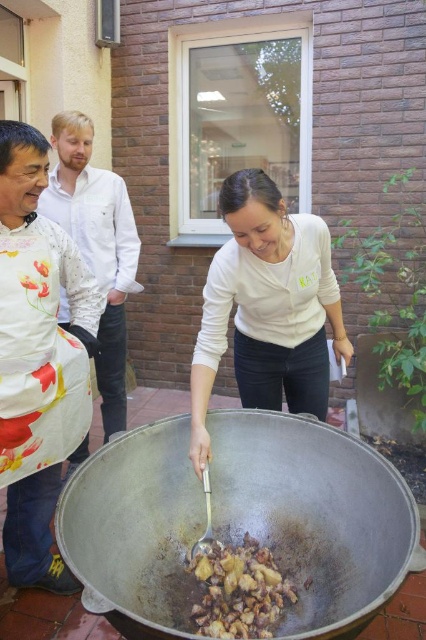
Question: Is stainless steel wok at center in front of floral fabric apron at left?

Choices:
 (A) yes
 (B) no

Answer: (A)

Question: Which of the following is the farthest from the observer?

Choices:
 (A) (86, 298)
 (B) (60, 131)
 (C) (282, 602)
 (D) (290, 230)

Answer: (B)

Question: Which point is farther to the camera?

Choices:
 (A) (267, 390)
 (B) (282, 602)
 (C) (132, 228)
 (D) (89, 280)

Answer: (C)

Question: Can you confirm if stainless steel wok at center is positioned to the right of white matte shirt at center?

Choices:
 (A) no
 (B) yes

Answer: (A)

Question: Which of the following is the farthest from the observer?

Choices:
 (A) stainless steel wok at center
 (B) white matte shirt at center

Answer: (B)

Question: Can you confirm if white floral apron at left is positioned to the right of floral fabric apron at left?

Choices:
 (A) no
 (B) yes

Answer: (B)